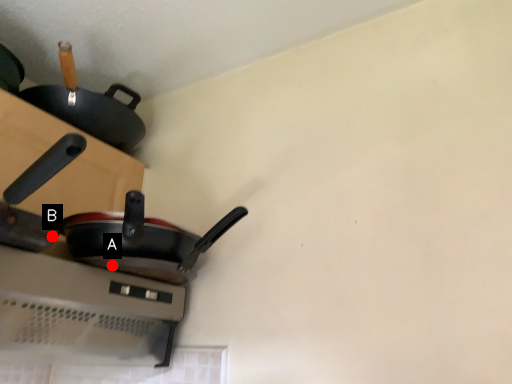
Question: Two points are circled on the image, labeled by A and B beside each circle. Among these points, which one is nearest to the camera?

Choices:
 (A) A is closer
 (B) B is closer

Answer: (B)